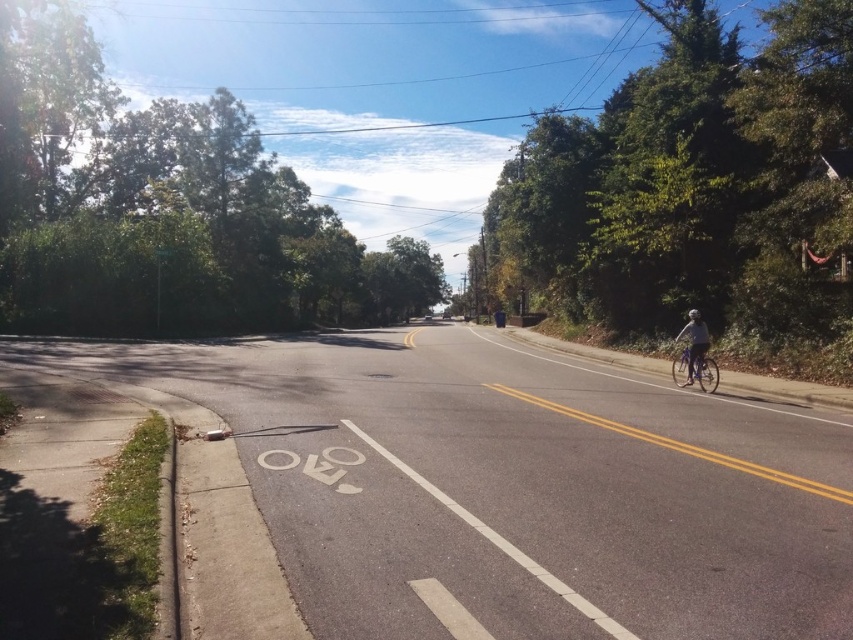
Is metallic silver bicycle at right shorter than black matte bicycle helmet at right?

Yes.

Can you confirm if metallic silver bicycle at right is positioned to the right of black matte bicycle helmet at right?

Incorrect, metallic silver bicycle at right is not on the right side of black matte bicycle helmet at right.

What do you see at coordinates (695, 358) in the screenshot?
I see `metallic silver bicycle at right` at bounding box center [695, 358].

This screenshot has height=640, width=853. Find the location of `metallic silver bicycle at right`. metallic silver bicycle at right is located at coordinates (695, 358).

Is gray fabric helmet at right above black matte bicycle helmet at right?

Actually, gray fabric helmet at right is below black matte bicycle helmet at right.

Is point (688, 356) positioned after point (691, 316)?

Yes, point (688, 356) is behind point (691, 316).

The width and height of the screenshot is (853, 640). In order to click on gray fabric helmet at right in this screenshot , I will do `click(694, 342)`.

Which is in front, point (500, 561) or point (691, 310)?

Point (500, 561) is in front.

Does white painted bike lane at center appear on the right side of black matte bicycle helmet at right?

In fact, white painted bike lane at center is to the left of black matte bicycle helmet at right.

You are a GUI agent. You are given a task and a screenshot of the screen. Output one action in this format:
    pyautogui.click(x=<x>, y=<y>)
    Task: Click on the white painted bike lane at center
    The width and height of the screenshot is (853, 640).
    Given the screenshot: What is the action you would take?
    pyautogui.click(x=514, y=486)